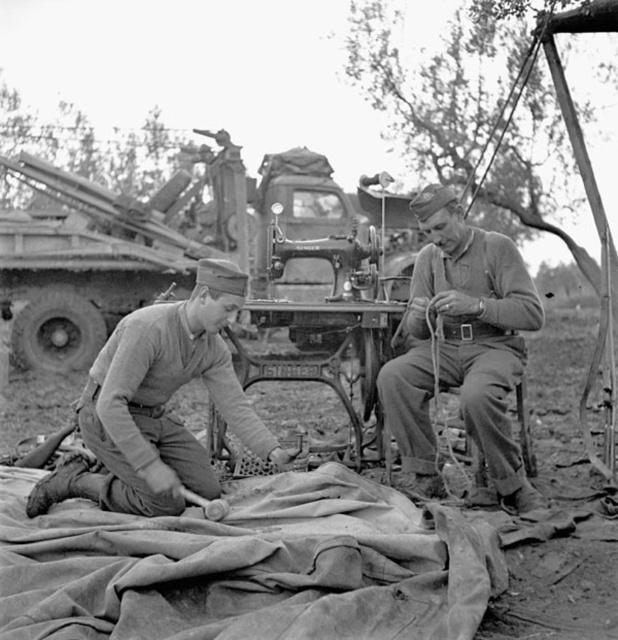
Does matte khaki uniform at center appear under cast iron sewing machine at center?

Correct, matte khaki uniform at center is located below cast iron sewing machine at center.

From the picture: Measure the distance between matte khaki uniform at center and cast iron sewing machine at center.

matte khaki uniform at center is 19.62 inches from cast iron sewing machine at center.

Does point (454, 289) lie in front of point (316, 326)?

Yes.

You are a GUI agent. You are given a task and a screenshot of the screen. Output one action in this format:
    pyautogui.click(x=<x>, y=<y>)
    Task: Click on the matte khaki uniform at center
    
    Given the screenshot: What is the action you would take?
    pyautogui.click(x=462, y=348)

Find the location of `camouflage fabric at lower left`. camouflage fabric at lower left is located at coordinates (158, 404).

Is rough canvas blanket at lower center smaller than cast iron sewing machine at center?

Correct, rough canvas blanket at lower center occupies less space than cast iron sewing machine at center.

Does rough canvas blanket at lower center have a greater width compared to cast iron sewing machine at center?

Correct, the width of rough canvas blanket at lower center exceeds that of cast iron sewing machine at center.

Which is in front, point (316, 483) or point (358, 317)?

Point (316, 483) is in front.

Locate an element on the screen. rough canvas blanket at lower center is located at coordinates (247, 566).